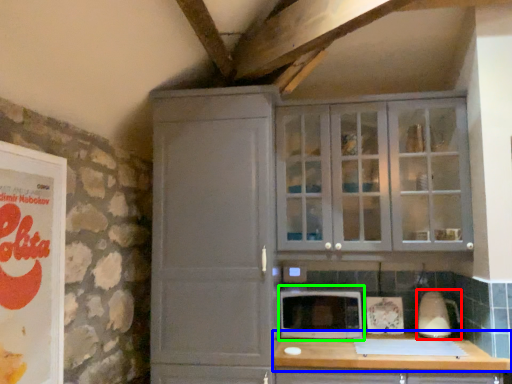
Question: Based on their relative distances, which object is farther from appliance (highlighted by a red box)? Choose from countertop (highlighted by a blue box) and microwave oven (highlighted by a green box).

Choices:
 (A) countertop
 (B) microwave oven

Answer: (B)